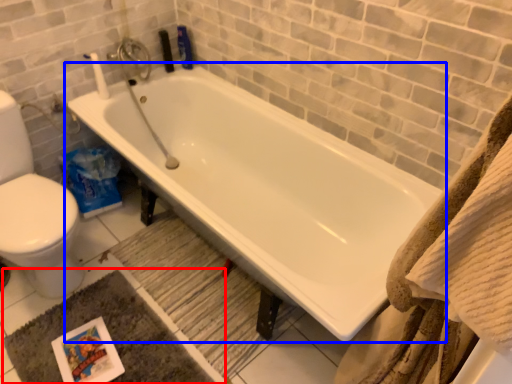
Question: Which point is further to the camera, bath mat (highlighted by a red box) or bathtub (highlighted by a blue box)?

Choices:
 (A) bath mat
 (B) bathtub

Answer: (A)